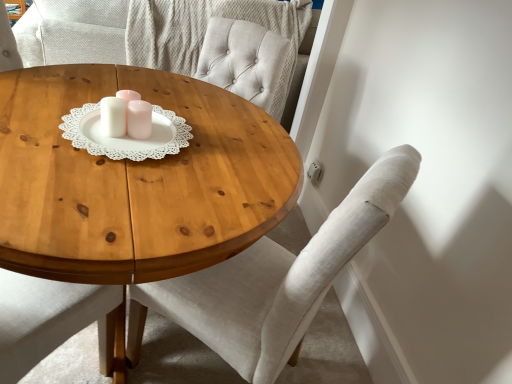
The width and height of the screenshot is (512, 384). I want to click on free space to the right of white glossy candle holder at center, so click(192, 144).